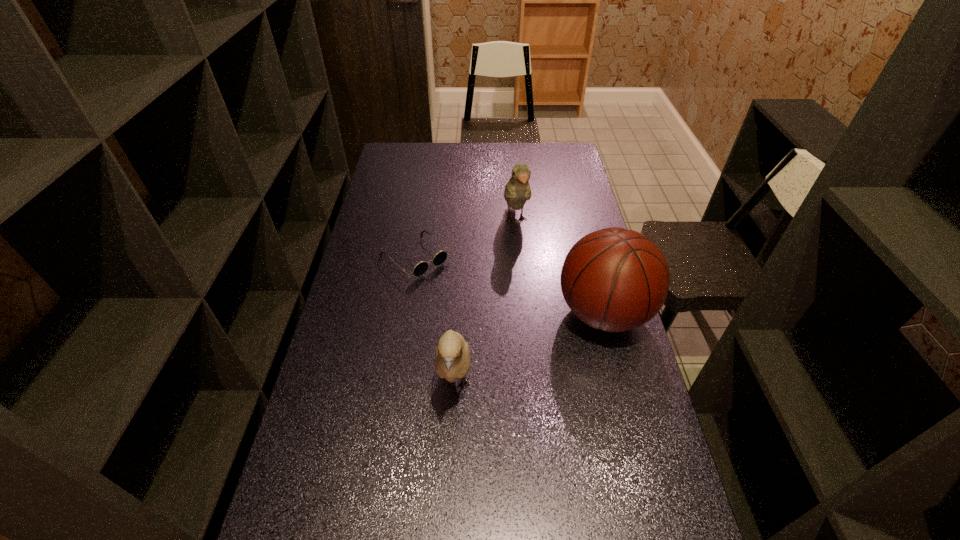
The image size is (960, 540). Identify the location of vacant space on the desktop that is between the left bird and the rightmost object and is positioned at the face of the third object from left to right. (542, 342).

Image resolution: width=960 pixels, height=540 pixels. I want to click on vacant space on the desktop that is between the left bird and the rightmost object and is positioned on the front-facing side of the sunglasses, so click(522, 352).